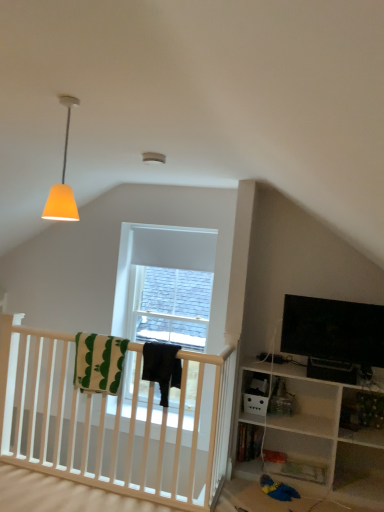
Question: Is orange matte lampshade at upper left facing towards white cotton blanket at center, the second blanket in the right-to-left sequence?

Choices:
 (A) yes
 (B) no

Answer: (B)

Question: From the image's perspective, is orange matte lampshade at upper left beneath white cotton blanket at center, the second blanket in the right-to-left sequence?

Choices:
 (A) no
 (B) yes

Answer: (A)

Question: Are orange matte lampshade at upper left and white cotton blanket at center, positioned as the first blanket in left-to-right order, far apart?

Choices:
 (A) yes
 (B) no

Answer: (A)

Question: Is orange matte lampshade at upper left shorter than white cotton blanket at center, the second blanket in the right-to-left sequence?

Choices:
 (A) yes
 (B) no

Answer: (B)

Question: Is orange matte lampshade at upper left at the right side of white cotton blanket at center, the second blanket in the right-to-left sequence?

Choices:
 (A) yes
 (B) no

Answer: (A)

Question: From the image's perspective, relative to wooden bookshelf at lower right, is black fabric at center, the second blanket when ordered from left to right, above or below?

Choices:
 (A) below
 (B) above

Answer: (B)

Question: Is black fabric at center, placed as the 1th blanket when sorted from right to left, to the left or to the right of wooden bookshelf at lower right in the image?

Choices:
 (A) left
 (B) right

Answer: (A)

Question: Does point (148, 374) appear closer or farther from the camera than point (345, 396)?

Choices:
 (A) closer
 (B) farther

Answer: (A)

Question: Is black fabric at center, the second blanket when ordered from left to right, wider or thinner than wooden bookshelf at lower right?

Choices:
 (A) wide
 (B) thin

Answer: (A)

Question: In terms of size, does white cotton blanket at center, positioned as the first blanket in left-to-right order, appear bigger or smaller than black fabric at center, the second blanket when ordered from left to right?

Choices:
 (A) small
 (B) big

Answer: (B)

Question: In terms of width, does white cotton blanket at center, the second blanket in the right-to-left sequence, look wider or thinner when compared to black fabric at center, the second blanket when ordered from left to right?

Choices:
 (A) wide
 (B) thin

Answer: (B)

Question: From the image's perspective, is white cotton blanket at center, the second blanket in the right-to-left sequence, above or below black fabric at center, placed as the 1th blanket when sorted from right to left?

Choices:
 (A) below
 (B) above

Answer: (B)

Question: Is point (87, 373) closer or farther from the camera than point (167, 400)?

Choices:
 (A) closer
 (B) farther

Answer: (B)

Question: In the image, is wooden bookshelf at lower right positioned in front of or behind black fabric at center, placed as the 1th blanket when sorted from right to left?

Choices:
 (A) behind
 (B) front

Answer: (A)

Question: Is point (352, 406) positioned closer to the camera than point (175, 366)?

Choices:
 (A) farther
 (B) closer

Answer: (A)